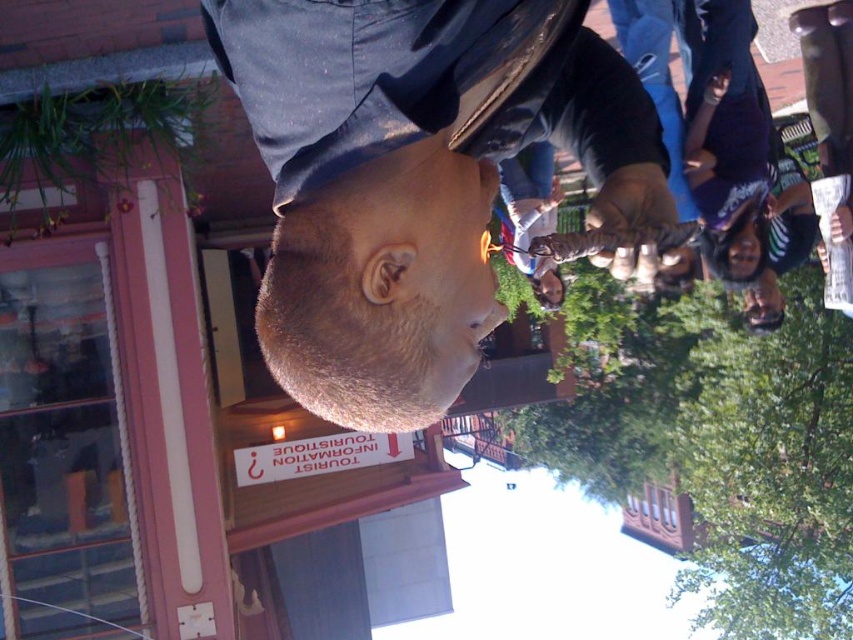
Can you confirm if matte black jacket at center is bigger than matte black head at lower right?

Indeed, matte black jacket at center has a larger size compared to matte black head at lower right.

Looking at this image, does matte black jacket at center appear on the left side of matte black head at lower right?

Indeed, matte black jacket at center is positioned on the left side of matte black head at lower right.

Is point (453, 116) positioned before point (753, 285)?

Yes, it is.

Image resolution: width=853 pixels, height=640 pixels. Find the location of `matte black jacket at center`. matte black jacket at center is located at coordinates (415, 177).

Is matte black jacket at center positioned in front of smooth skin head at center?

Yes.

Who is more forward, (x=544, y=99) or (x=444, y=387)?

Positioned in front is point (x=444, y=387).

Who is more distant from viewer, [346,161] or [329,220]?

The point [329,220] is behind.

This screenshot has height=640, width=853. I want to click on matte black jacket at center, so click(415, 177).

Is smooth skin head at center positioned in front of matte black head at lower right?

That is True.

Image resolution: width=853 pixels, height=640 pixels. Find the location of `smooth skin head at center`. smooth skin head at center is located at coordinates (381, 289).

Image resolution: width=853 pixels, height=640 pixels. I want to click on smooth skin head at center, so click(x=381, y=289).